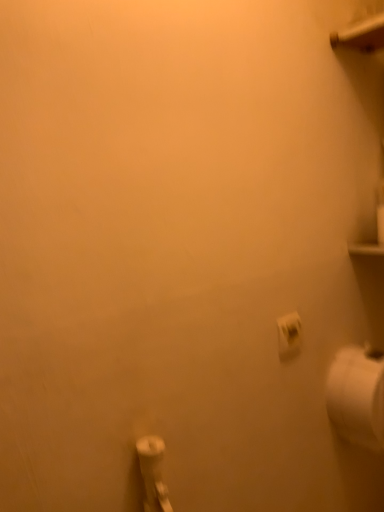
In order to face white matte toilet paper at right, the second toilet paper from the left, should I rotate leftwards or rightwards?

To align with it, rotate right about 23.389°.

This screenshot has width=384, height=512. Describe the element at coordinates (357, 397) in the screenshot. I see `white matte toilet paper at right, arranged as the first toilet paper when viewed from the back` at that location.

Find the location of a particular element. This screenshot has height=512, width=384. white matte toilet paper at right, the second toilet paper from the left is located at coordinates (357, 397).

The width and height of the screenshot is (384, 512). Find the location of `white matte toilet paper at lower right, marked as the 1th toilet paper in a left-to-right arrangement`. white matte toilet paper at lower right, marked as the 1th toilet paper in a left-to-right arrangement is located at coordinates (289, 335).

Image resolution: width=384 pixels, height=512 pixels. Describe the element at coordinates (289, 335) in the screenshot. I see `white matte toilet paper at lower right, the second toilet paper ordered from the bottom` at that location.

Locate an element on the screen. The height and width of the screenshot is (512, 384). white matte toilet paper at right, arranged as the first toilet paper when viewed from the back is located at coordinates (357, 397).

Would you say white matte toilet paper at right, the 2th toilet paper when ordered from top to bottom, is to the left or to the right of white matte toilet paper at lower right, which is the first toilet paper from front to back, in the picture?

From the image, it's evident that white matte toilet paper at right, the 2th toilet paper when ordered from top to bottom, is to the right of white matte toilet paper at lower right, which is the first toilet paper from front to back.

Between white matte toilet paper at right, placed as the second toilet paper when sorted from front to back, and white matte toilet paper at lower right, the second toilet paper in the back-to-front sequence, which one is positioned in front?

white matte toilet paper at lower right, the second toilet paper in the back-to-front sequence, is in front.

Is point (358, 414) positioned before point (278, 329)?

That is False.

From the image's perspective, is white matte toilet paper at right, arranged as the first toilet paper when viewed from the back, positioned above or below white matte toilet paper at lower right, marked as the 1th toilet paper in a left-to-right arrangement?

From the image's perspective, white matte toilet paper at right, arranged as the first toilet paper when viewed from the back, appears below white matte toilet paper at lower right, marked as the 1th toilet paper in a left-to-right arrangement.

From a real-world perspective, who is located lower, white matte toilet paper at right, the 2th toilet paper when ordered from top to bottom, or white matte toilet paper at lower right, the second toilet paper in the right-to-left sequence?

white matte toilet paper at right, the 2th toilet paper when ordered from top to bottom, is physically lower.

Is white matte toilet paper at right, placed as the second toilet paper when sorted from front to back, thinner than white matte toilet paper at lower right, which is the first toilet paper from front to back?

In fact, white matte toilet paper at right, placed as the second toilet paper when sorted from front to back, might be wider than white matte toilet paper at lower right, which is the first toilet paper from front to back.

Is white matte toilet paper at right, which is counted as the first toilet paper, starting from the bottom, shorter than white matte toilet paper at lower right, the second toilet paper in the back-to-front sequence?

In fact, white matte toilet paper at right, which is counted as the first toilet paper, starting from the bottom, may be taller than white matte toilet paper at lower right, the second toilet paper in the back-to-front sequence.

Considering the sizes of objects white matte toilet paper at right, placed as the second toilet paper when sorted from front to back, and white matte toilet paper at lower right, the second toilet paper ordered from the bottom, in the image provided, who is bigger, white matte toilet paper at right, placed as the second toilet paper when sorted from front to back, or white matte toilet paper at lower right, the second toilet paper ordered from the bottom,?

Bigger between the two is white matte toilet paper at right, placed as the second toilet paper when sorted from front to back.

Is white matte toilet paper at right, the second toilet paper from the left, inside or outside of white matte toilet paper at lower right, the second toilet paper in the right-to-left sequence?

white matte toilet paper at right, the second toilet paper from the left, is not inside white matte toilet paper at lower right, the second toilet paper in the right-to-left sequence, it's outside.

Is white matte toilet paper at right, the 2th toilet paper when ordered from top to bottom, placed right next to white matte toilet paper at lower right, marked as the 1th toilet paper in a left-to-right arrangement?

There is a gap between white matte toilet paper at right, the 2th toilet paper when ordered from top to bottom, and white matte toilet paper at lower right, marked as the 1th toilet paper in a left-to-right arrangement.

Is white matte toilet paper at right, which is counted as the first toilet paper, starting from the bottom, turned away from white matte toilet paper at lower right, marked as the 1th toilet paper in a left-to-right arrangement?

No, white matte toilet paper at right, which is counted as the first toilet paper, starting from the bottom, is not facing away from white matte toilet paper at lower right, marked as the 1th toilet paper in a left-to-right arrangement.

What's the angular difference between white matte toilet paper at right, which is counted as the first toilet paper, starting from the bottom, and white matte toilet paper at lower right, which is the first toilet paper from front to back,'s facing directions?

They differ by 1.3 degrees in their facing directions.

Locate an element on the screen. toilet paper lying in front of the white matte toilet paper at right, the 2th toilet paper when ordered from top to bottom is located at coordinates (289, 335).

Which object is positioned more to the left, white matte toilet paper at lower right, acting as the 1th toilet paper starting from the top, or white matte toilet paper at right, which is counted as the first toilet paper, starting from the bottom?

white matte toilet paper at lower right, acting as the 1th toilet paper starting from the top, is more to the left.

Relative to white matte toilet paper at right, placed as the second toilet paper when sorted from front to back, is white matte toilet paper at lower right, the second toilet paper ordered from the bottom, in front or behind?

white matte toilet paper at lower right, the second toilet paper ordered from the bottom, is in front of white matte toilet paper at right, placed as the second toilet paper when sorted from front to back.

From the picture: Which is less distant, (287, 318) or (379, 414)?

Positioned in front is point (287, 318).

From the image's perspective, is white matte toilet paper at lower right, acting as the 1th toilet paper starting from the top, located above white matte toilet paper at right, arranged as the first toilet paper when viewed from the back?

Yes, from the image's perspective, white matte toilet paper at lower right, acting as the 1th toilet paper starting from the top, is above white matte toilet paper at right, arranged as the first toilet paper when viewed from the back.

From the picture: From a real-world perspective, does white matte toilet paper at lower right, marked as the 1th toilet paper in a left-to-right arrangement, sit lower than white matte toilet paper at right, the 1th toilet paper when ordered from right to left?

No, from a real-world perspective, white matte toilet paper at lower right, marked as the 1th toilet paper in a left-to-right arrangement, is not under white matte toilet paper at right, the 1th toilet paper when ordered from right to left.

Is white matte toilet paper at lower right, the second toilet paper ordered from the bottom, wider than white matte toilet paper at right, which is counted as the first toilet paper, starting from the bottom?

No.

Who is shorter, white matte toilet paper at lower right, the second toilet paper ordered from the bottom, or white matte toilet paper at right, which is counted as the first toilet paper, starting from the bottom?

With less height is white matte toilet paper at lower right, the second toilet paper ordered from the bottom.

Based on their sizes in the image, would you say white matte toilet paper at lower right, acting as the 1th toilet paper starting from the top, is bigger or smaller than white matte toilet paper at right, placed as the second toilet paper when sorted from front to back?

Clearly, white matte toilet paper at lower right, acting as the 1th toilet paper starting from the top, is smaller in size than white matte toilet paper at right, placed as the second toilet paper when sorted from front to back.

Is white matte toilet paper at lower right, the second toilet paper in the right-to-left sequence, spatially inside white matte toilet paper at right, the second toilet paper from the left, or outside of it?

white matte toilet paper at lower right, the second toilet paper in the right-to-left sequence, is spatially situated outside white matte toilet paper at right, the second toilet paper from the left.

Is white matte toilet paper at lower right, marked as the 1th toilet paper in a left-to-right arrangement, directly adjacent to white matte toilet paper at right, which is counted as the first toilet paper, starting from the bottom?

No, white matte toilet paper at lower right, marked as the 1th toilet paper in a left-to-right arrangement, is not making contact with white matte toilet paper at right, which is counted as the first toilet paper, starting from the bottom.

Is white matte toilet paper at lower right, which is the first toilet paper from front to back, looking in the opposite direction of white matte toilet paper at right, the 2th toilet paper when ordered from top to bottom?

No, white matte toilet paper at right, the 2th toilet paper when ordered from top to bottom, is not at the back of white matte toilet paper at lower right, which is the first toilet paper from front to back.

How different are the orientations of white matte toilet paper at lower right, marked as the 1th toilet paper in a left-to-right arrangement, and white matte toilet paper at right, the second toilet paper from the left, in degrees?

white matte toilet paper at lower right, marked as the 1th toilet paper in a left-to-right arrangement, and white matte toilet paper at right, the second toilet paper from the left, are facing 1.3 degrees away from each other.

Measure the distance between white matte toilet paper at lower right, which is the first toilet paper from front to back, and white matte toilet paper at right, the 2th toilet paper when ordered from top to bottom.

white matte toilet paper at lower right, which is the first toilet paper from front to back, is 8.25 inches away from white matte toilet paper at right, the 2th toilet paper when ordered from top to bottom.

I want to click on toilet paper lying above the white matte toilet paper at right, the 2th toilet paper when ordered from top to bottom (from the image's perspective), so click(289, 335).

Identify the location of toilet paper located above the white matte toilet paper at right, the 1th toilet paper when ordered from right to left (from a real-world perspective). (289, 335).

Where is `toilet paper below the white matte toilet paper at lower right, acting as the 1th toilet paper starting from the top (from the image's perspective)`? This screenshot has width=384, height=512. toilet paper below the white matte toilet paper at lower right, acting as the 1th toilet paper starting from the top (from the image's perspective) is located at coordinates (357, 397).